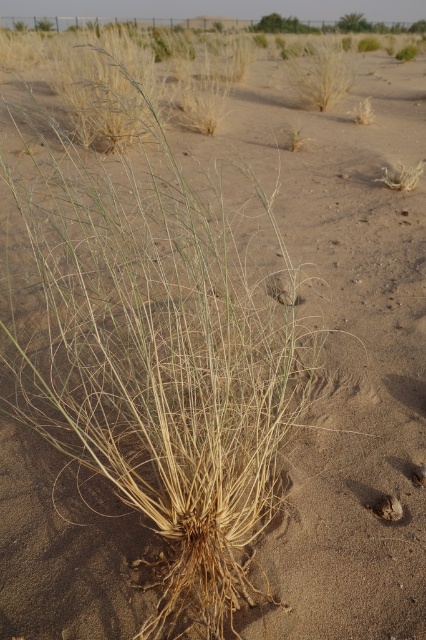
Question: Does dry straw-like plant at upper right have a larger size compared to dry grass at center?

Choices:
 (A) yes
 (B) no

Answer: (B)

Question: Does dry grass at upper center appear on the right side of dry straw-like plant at upper right?

Choices:
 (A) no
 (B) yes

Answer: (B)

Question: Among these points, which one is nearest to the camera?

Choices:
 (A) (363, 106)
 (B) (417, 176)

Answer: (B)

Question: Is dry straw-like plant at upper right in front of dry grass at center?

Choices:
 (A) yes
 (B) no

Answer: (A)

Question: Which of the following is the farthest from the observer?

Choices:
 (A) (302, 74)
 (B) (402, 164)

Answer: (A)

Question: Which point is closer to the camera?

Choices:
 (A) dry straw-like plant at upper right
 (B) dry grass at upper center
 (C) dry grass at center

Answer: (A)